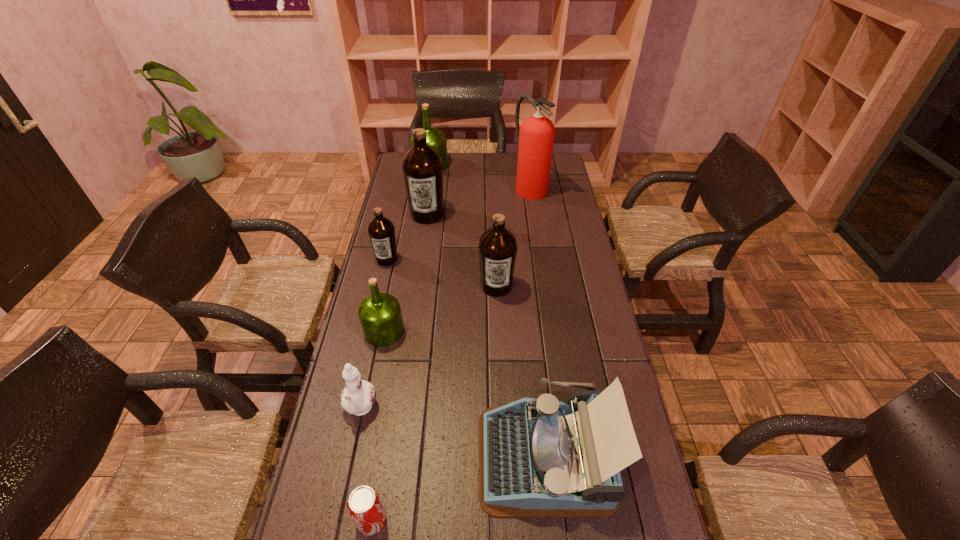
Identify which brown olive oil is the nearest to the eighth shortest object. Please provide its 2D coordinates. Your answer should be formatted as a tuple, i.e. [(x, y)], where the tuple contains the x and y coordinates of a point satisfying the conditions above.

[(381, 231)]

You are a GUI agent. You are given a task and a screenshot of the screen. Output one action in this format:
    pyautogui.click(x=<x>, y=<y>)
    Task: Click on the brown olive oil that can be found as the closest to the third farthest olive oil
    This screenshot has width=960, height=540.
    Given the screenshot: What is the action you would take?
    pyautogui.click(x=422, y=167)